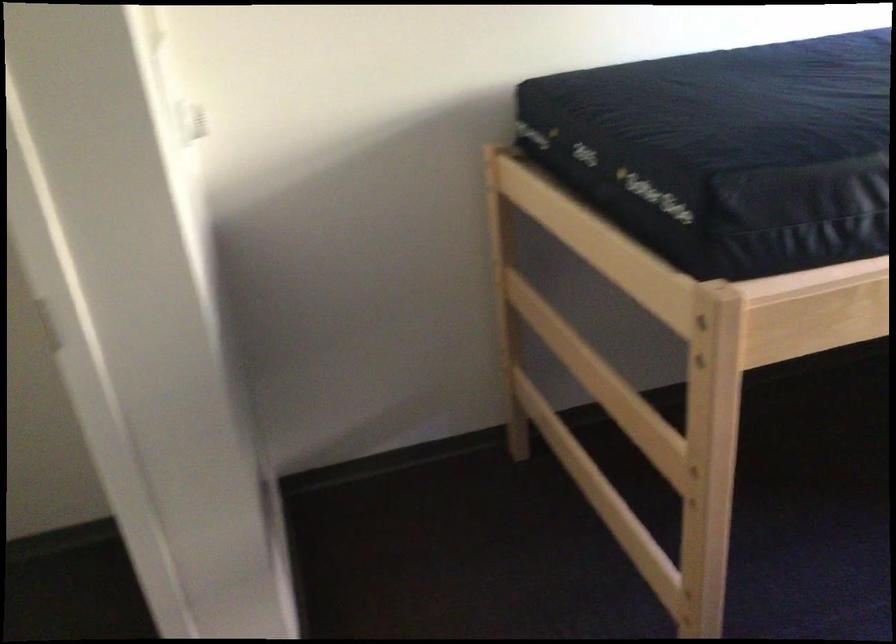
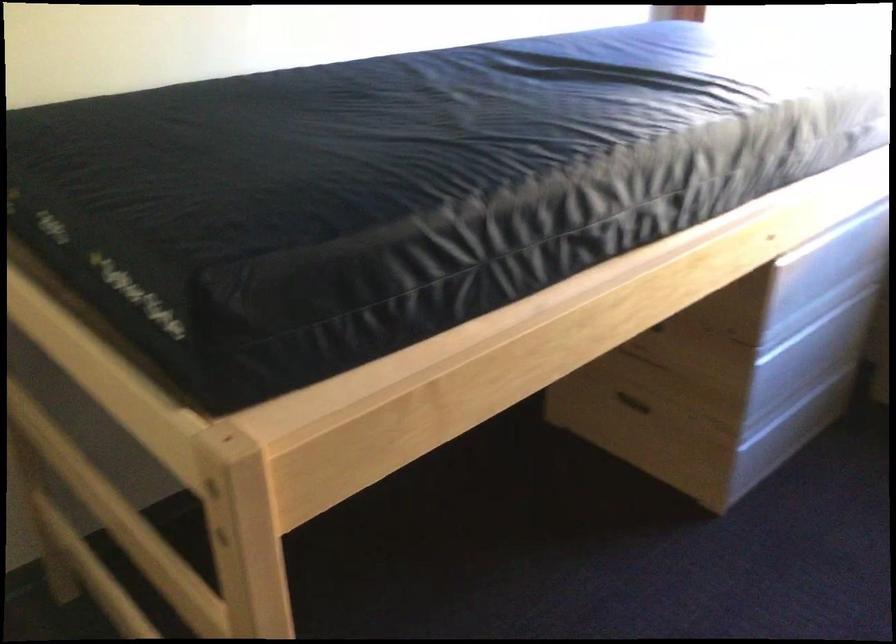
Find the pixel in the second image that matches (547,482) in the first image.

(112, 632)